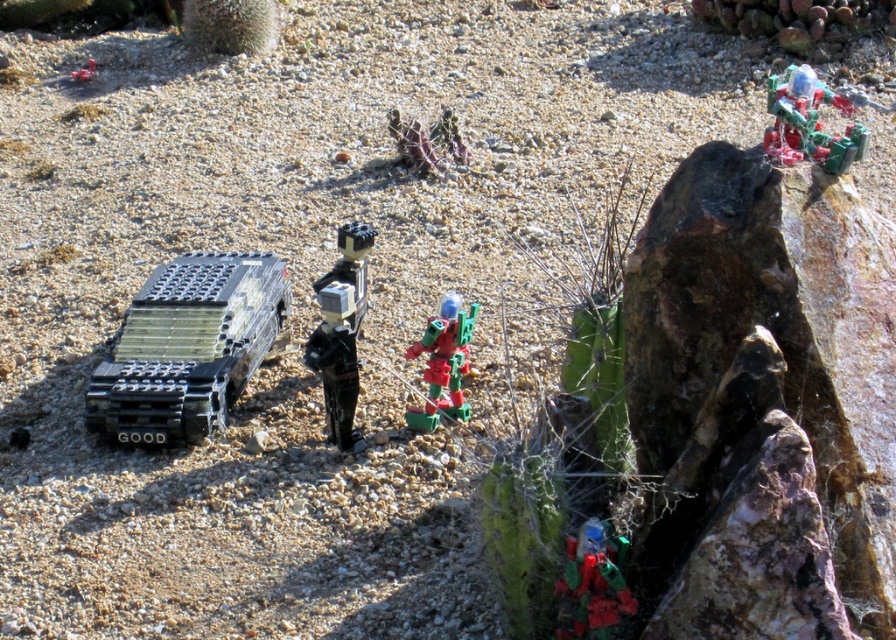
You are a LEGO figure standing at the black matte figure at center. You need to reach the shiny plastic robot at upper right to activate its power. The activation requires you to be within 1 meter to press the button. Can you reach it without moving?

The black matte figure at center is 1.10 meters away from the shiny plastic robot at upper right, which is beyond the 1 meter required for activation. Therefore, you cannot reach it without moving.

You are a LEGO figure standing next to the black plastic tank at left. You need to reach the shiny plastic robot at upper right to activate it. Can you walk directly to the robot without moving any objects?

The black plastic tank at left is 1.45 meters away from the shiny plastic robot at upper right. Since there are no obstacles mentioned in the scene, you can walk directly to the robot without moving any objects.